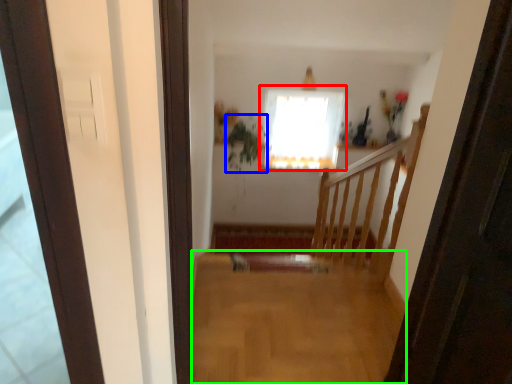
Question: Which is nearer to the window (highlighted by a red box)? plant (highlighted by a blue box) or plain (highlighted by a green box).

Choices:
 (A) plant
 (B) plain

Answer: (A)